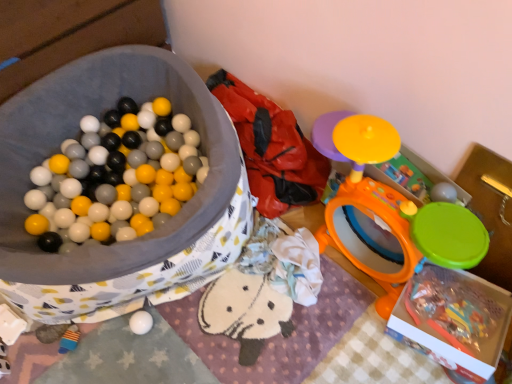
Question: Which direction should I rotate to face white matte ball at lower center, marked as the third toy in a right-to-left arrangement, — up or down?

Choices:
 (A) up
 (B) down

Answer: (B)

Question: Is matte yellow plastic toy at upper right, the 1th toy positioned from the right, to the right of translucent plastic storage box at lower right, the second storage box when ordered from left to right, from the viewer's perspective?

Choices:
 (A) no
 (B) yes

Answer: (A)

Question: Is matte yellow plastic toy at upper right, the 1th toy positioned from the top, next to translucent plastic storage box at lower right, the first storage box in the right-to-left sequence, and touching it?

Choices:
 (A) yes
 (B) no

Answer: (B)

Question: Can we say matte yellow plastic toy at upper right, which appears as the fourth toy when ordered from the bottom, lies outside translucent plastic storage box at lower right, the first storage box in the right-to-left sequence?

Choices:
 (A) yes
 (B) no

Answer: (A)

Question: From a real-world perspective, is matte yellow plastic toy at upper right, which appears as the fourth toy when ordered from the bottom, positioned under translucent plastic storage box at lower right, the first storage box in the right-to-left sequence, based on gravity?

Choices:
 (A) no
 (B) yes

Answer: (A)

Question: Is matte yellow plastic toy at upper right, the 1th toy positioned from the right, to the left of translucent plastic storage box at lower right, the second storage box when ordered from left to right, from the viewer's perspective?

Choices:
 (A) yes
 (B) no

Answer: (A)

Question: From the image's perspective, is matte yellow plastic toy at upper right, the 1th toy positioned from the right, on translucent plastic storage box at lower right, the second storage box when ordered from left to right?

Choices:
 (A) yes
 (B) no

Answer: (A)

Question: Is matte yellow plastic toy at upper right, which appears as the fourth toy when ordered from the bottom, taller than orange plastic drum at upper right, which is the third toy in bottom-to-top order?

Choices:
 (A) yes
 (B) no

Answer: (B)

Question: Could you tell me if matte yellow plastic toy at upper right, marked as the fourth toy in a left-to-right arrangement, is turned towards orange plastic drum at upper right, the 3th toy positioned from the left?

Choices:
 (A) yes
 (B) no

Answer: (A)

Question: From the image's perspective, is matte yellow plastic toy at upper right, the 1th toy positioned from the right, located above orange plastic drum at upper right, the 3th toy positioned from the left?

Choices:
 (A) no
 (B) yes

Answer: (B)

Question: Considering the relative sizes of matte yellow plastic toy at upper right, the 1th toy positioned from the top, and orange plastic drum at upper right, which is the third toy in bottom-to-top order, in the image provided, is matte yellow plastic toy at upper right, the 1th toy positioned from the top, wider than orange plastic drum at upper right, which is the third toy in bottom-to-top order,?

Choices:
 (A) yes
 (B) no

Answer: (B)

Question: Is matte yellow plastic toy at upper right, the 1th toy positioned from the right, next to orange plastic drum at upper right, the 3th toy positioned from the left?

Choices:
 (A) yes
 (B) no

Answer: (B)

Question: Would you say matte yellow plastic toy at upper right, marked as the fourth toy in a left-to-right arrangement, is outside orange plastic drum at upper right, which is the third toy in bottom-to-top order?

Choices:
 (A) yes
 (B) no

Answer: (B)

Question: Are soft fabric bean bag at center and matte plastic ball pit at left, the second storage box viewed from the right, beside each other?

Choices:
 (A) yes
 (B) no

Answer: (B)